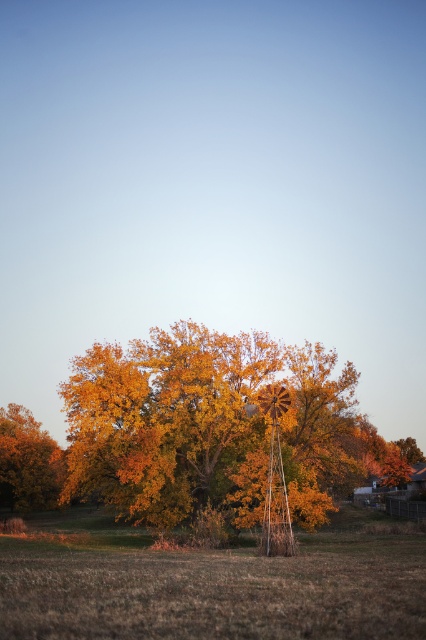
Question: Which object is farther from the camera taking this photo?

Choices:
 (A) golden wood tree at center
 (B) golden textured tree at lower left

Answer: (B)

Question: Which of these objects is positioned farthest from the golden wood tree at center?

Choices:
 (A) brown grass at center
 (B) golden textured tree at lower left

Answer: (B)

Question: Can you confirm if brown grass at center is wider than golden textured tree at lower left?

Choices:
 (A) no
 (B) yes

Answer: (B)

Question: Is golden wood tree at center behind golden textured tree at lower left?

Choices:
 (A) no
 (B) yes

Answer: (A)

Question: Does golden wood tree at center come in front of brown grass at center?

Choices:
 (A) no
 (B) yes

Answer: (A)

Question: Which of these objects is positioned farthest from the golden wood tree at center?

Choices:
 (A) brown grass at center
 (B) golden textured tree at lower left

Answer: (B)